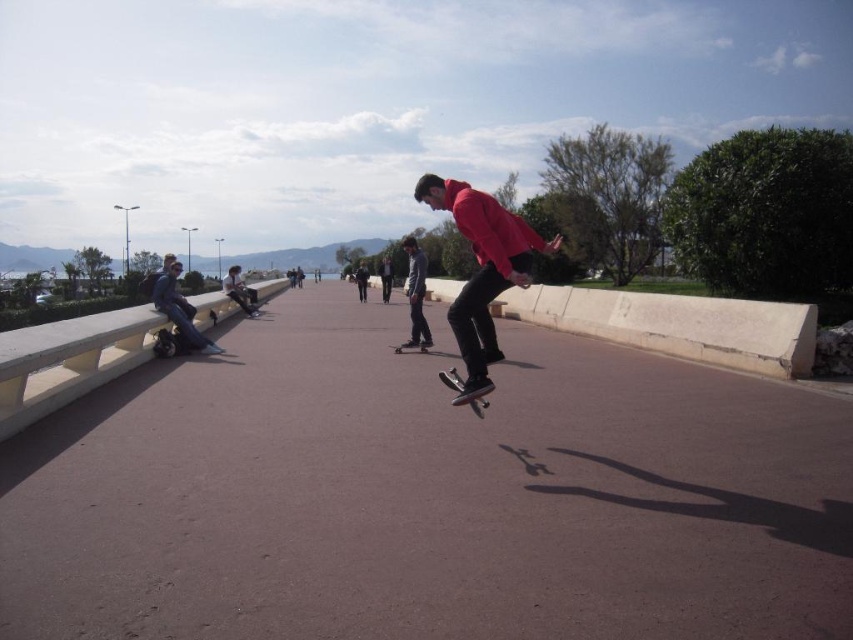
Question: Among these objects, which one is farthest from the camera?

Choices:
 (A) matte red hoodie at center
 (B) black smooth skateboard at center

Answer: (B)

Question: Does matte red hoodie at center have a smaller size compared to black matte skateboard at center?

Choices:
 (A) yes
 (B) no

Answer: (B)

Question: Which object appears closest to the camera in this image?

Choices:
 (A) matte red hoodie at center
 (B) matte blue jacket at left

Answer: (A)

Question: Which of the following is the farthest from the observer?

Choices:
 (A) (485, 404)
 (B) (167, 269)
 (C) (408, 340)
 (D) (402, 346)

Answer: (C)

Question: Is matte red hoodie at center closer to camera compared to black smooth skateboard at center?

Choices:
 (A) no
 (B) yes

Answer: (B)

Question: Can you confirm if matte red hoodie at center is positioned below black matte skateboard at center?

Choices:
 (A) yes
 (B) no

Answer: (B)